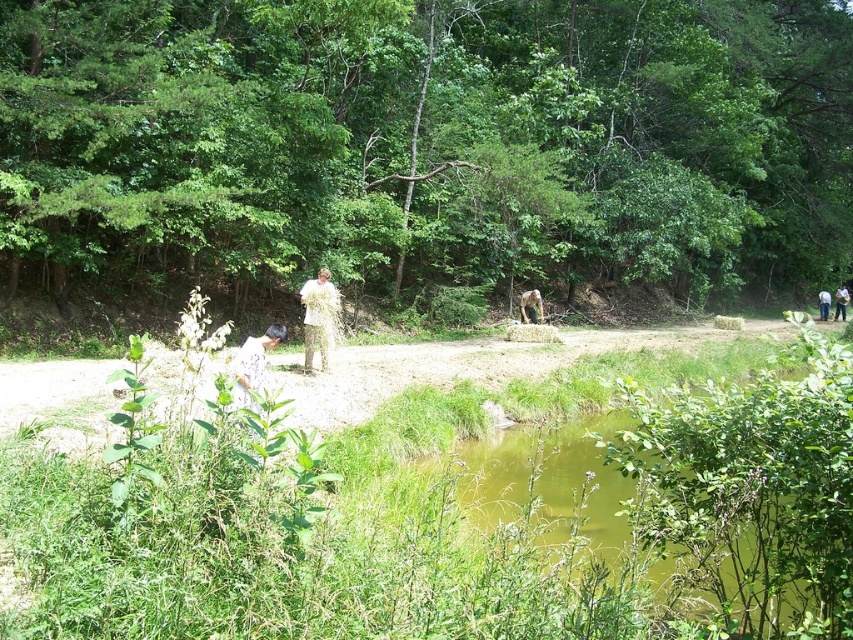
Question: Which of the following is the closest to the observer?

Choices:
 (A) (844, 307)
 (B) (825, 310)

Answer: (B)

Question: From the image, what is the correct spatial relationship of green murky water at lower center in relation to light brown straw at center?

Choices:
 (A) above
 (B) below

Answer: (B)

Question: Among these objects, which one is farthest from the camera?

Choices:
 (A) light brown straw at center
 (B) green fabric shirt at right

Answer: (B)

Question: Which point is closer to the camera?

Choices:
 (A) (25, 141)
 (B) (767, 609)
 (C) (534, 321)
 (D) (825, 296)

Answer: (B)

Question: Observing the image, what is the correct spatial positioning of green leafy tree at center in reference to white cotton shirt at right?

Choices:
 (A) above
 (B) below

Answer: (A)

Question: Does green leafy tree at center appear under light brown straw at center?

Choices:
 (A) yes
 (B) no

Answer: (B)